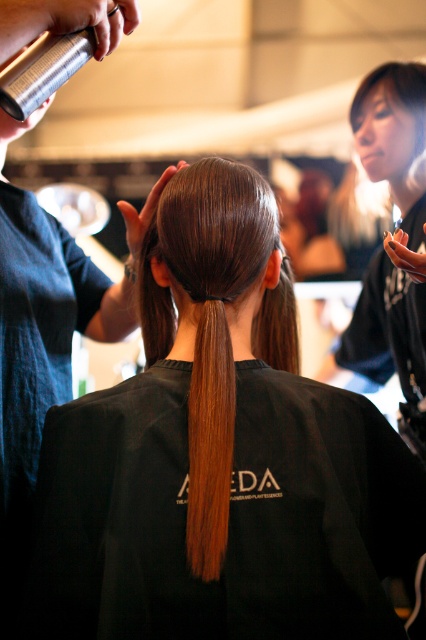
Question: Which object is farther from the camera taking this photo?

Choices:
 (A) shiny brown ponytail at center
 (B) brown shiny hair at center

Answer: (A)

Question: Does shiny brown ponytail at center have a larger size compared to smooth black hair at upper right?

Choices:
 (A) no
 (B) yes

Answer: (A)

Question: Among these objects, which one is nearest to the camera?

Choices:
 (A) shiny brown hair at center
 (B) shiny brown ponytail at center
 (C) smooth black hair at upper right

Answer: (A)

Question: Can you confirm if shiny brown ponytail at center is positioned to the left of smooth black hair at upper right?

Choices:
 (A) yes
 (B) no

Answer: (A)

Question: Which is farther from the shiny brown ponytail at center?

Choices:
 (A) shiny brown hair at center
 (B) smooth black hair at upper right

Answer: (B)

Question: In this image, where is brown shiny hair at center located relative to smooth black hair at upper right?

Choices:
 (A) below
 (B) above

Answer: (A)